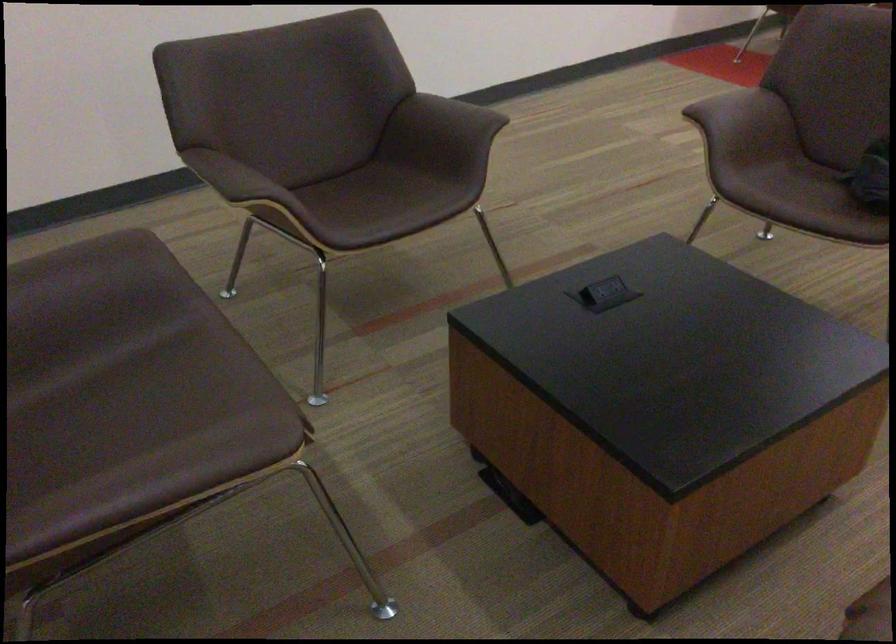
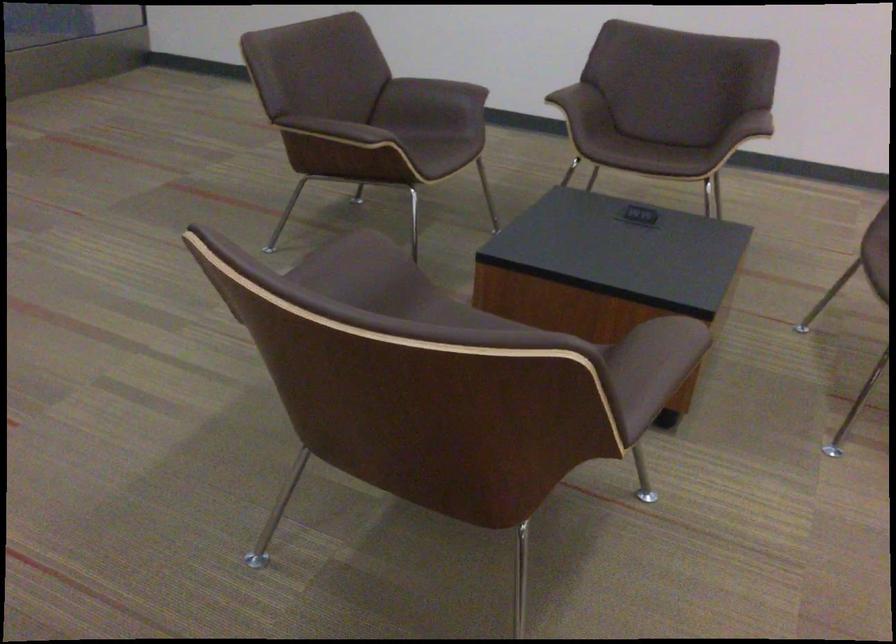
Where in the second image is the point corresponding to [192,379] from the first image?

(441, 151)